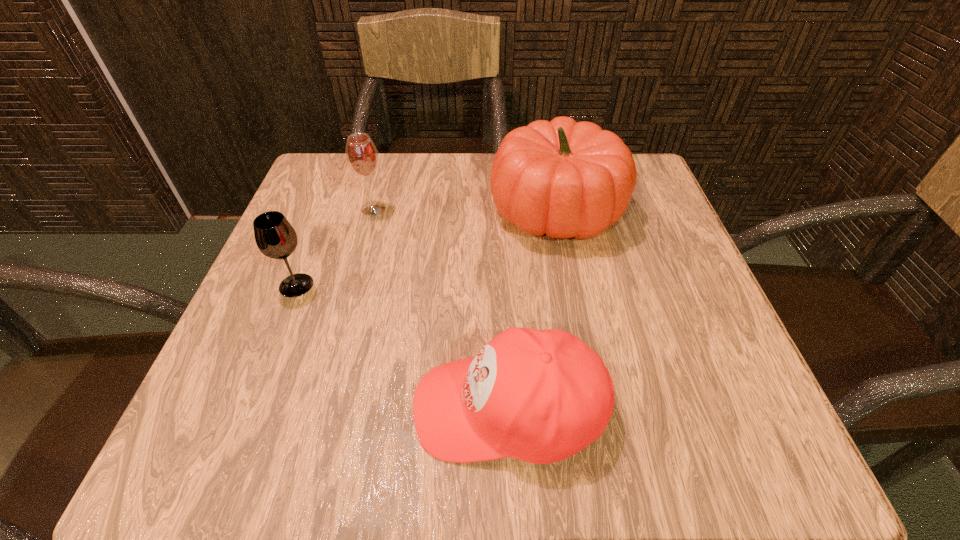
Identify the location of vacant space that's between the pumpkin and the second nearest object. This screenshot has height=540, width=960. (426, 248).

The image size is (960, 540). In order to click on free point between the left wineglass and the farther wineglass in this screenshot , I will do `click(335, 247)`.

Image resolution: width=960 pixels, height=540 pixels. Identify the location of free spot between the pumpkin and the nearer wineglass. (426, 248).

Where is `free spot between the farther wineglass and the pumpkin`? The image size is (960, 540). free spot between the farther wineglass and the pumpkin is located at coordinates (465, 210).

Locate an element on the screen. vacant region between the nearest object and the third object from right to left is located at coordinates (441, 308).

Find the location of a particular element. This screenshot has width=960, height=540. object that can be found as the second closest to the baseball cap is located at coordinates (275, 237).

Identify which object is the third closest to the pumpkin. Please provide its 2D coordinates. Your answer should be formatted as a tuple, i.e. [(x, y)], where the tuple contains the x and y coordinates of a point satisfying the conditions above.

[(275, 237)]

Where is `free location that satisfies the following two spatial constraints: 1. on the front side of the pumpkin; 2. on the front panel of the nearest object`? This screenshot has height=540, width=960. free location that satisfies the following two spatial constraints: 1. on the front side of the pumpkin; 2. on the front panel of the nearest object is located at coordinates (596, 408).